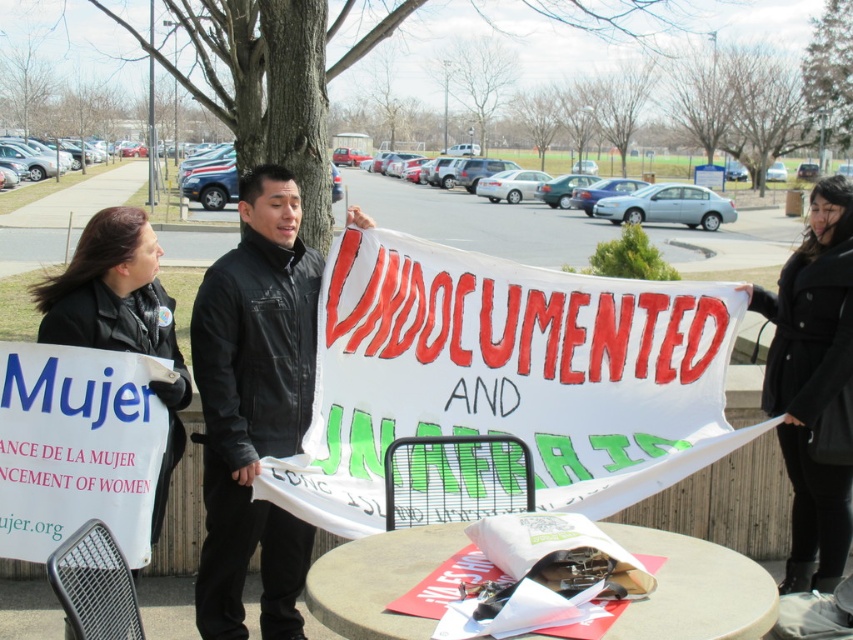
Between point (811, 282) and point (676, 632), which one is positioned in front?

Point (676, 632)

Is black wool coat at right above concrete table at center?

Yes, black wool coat at right is above concrete table at center.

Which is in front, point (799, 250) or point (349, 580)?

Point (349, 580) is in front.

I want to click on black wool coat at right, so click(x=811, y=381).

Who is shorter, black leather jacket at center or concrete table at center?

Standing shorter between the two is concrete table at center.

Who is more forward, (224, 554) or (346, 634)?

Point (346, 634) is in front.

At what (x,y) coordinates should I click in order to perform the action: click on black leather jacket at center. Please return your answer as a coordinate pair (x, y). Image resolution: width=853 pixels, height=640 pixels. Looking at the image, I should click on (254, 404).

Can you confirm if black wool coat at right is positioned to the right of black leather jacket at left?

Correct, you'll find black wool coat at right to the right of black leather jacket at left.

Who is taller, black wool coat at right or black leather jacket at left?

Standing taller between the two is black wool coat at right.

Between point (822, 467) and point (143, 243), which one is positioned in front?

Positioned in front is point (143, 243).

You are a GUI agent. You are given a task and a screenshot of the screen. Output one action in this format:
    pyautogui.click(x=<x>, y=<y>)
    Task: Click on the black wool coat at right
    Image resolution: width=853 pixels, height=640 pixels.
    Given the screenshot: What is the action you would take?
    pyautogui.click(x=811, y=381)